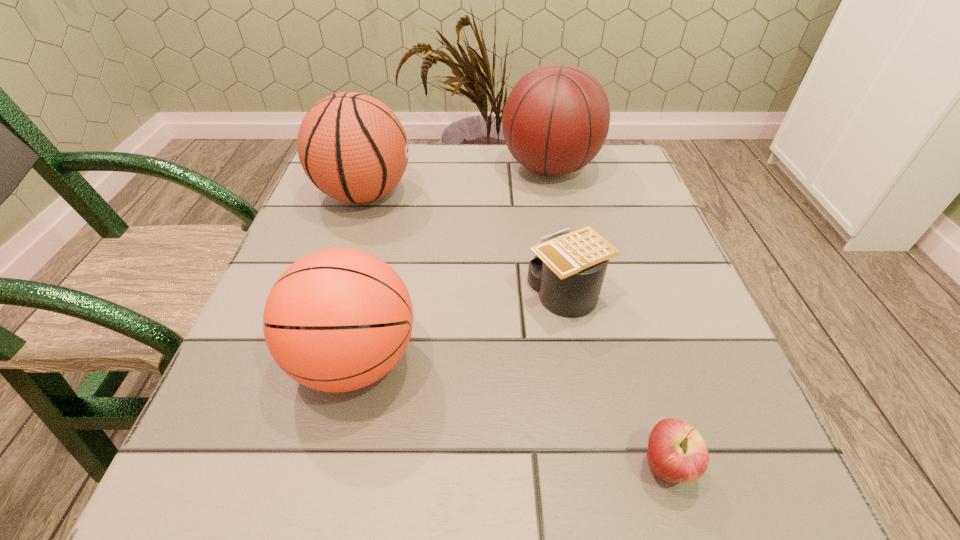
At what (x,y) coordinates should I click in order to perform the action: click on the rightmost basketball. Please return your answer as a coordinate pair (x, y). Looking at the image, I should click on (556, 119).

You are a GUI agent. You are given a task and a screenshot of the screen. Output one action in this format:
    pyautogui.click(x=<x>, y=<y>)
    Task: Click on the nearest basketball
    This screenshot has width=960, height=540.
    Given the screenshot: What is the action you would take?
    pyautogui.click(x=337, y=320)

This screenshot has width=960, height=540. I want to click on calculator, so click(568, 270).

Where is `apple`? apple is located at coordinates (677, 452).

This screenshot has width=960, height=540. I want to click on free space located 0.070m on the front of the rightmost basketball, so click(560, 215).

Where is `vacant area situated 0.300m on the back of the nearest basketball`? This screenshot has width=960, height=540. vacant area situated 0.300m on the back of the nearest basketball is located at coordinates (392, 206).

Locate an element on the screen. Image resolution: width=960 pixels, height=540 pixels. vacant space located 0.170m on the front of the calculator is located at coordinates (590, 423).

The width and height of the screenshot is (960, 540). What are the coordinates of `vacant space positioned 0.390m on the back of the nearest object` in the screenshot? It's located at (601, 247).

You are a GUI agent. You are given a task and a screenshot of the screen. Output one action in this format:
    pyautogui.click(x=<x>, y=<y>)
    Task: Click on the object that is at the near edge
    
    Given the screenshot: What is the action you would take?
    pyautogui.click(x=677, y=452)

At what (x,y) coordinates should I click in order to perform the action: click on basketball located in the right edge section of the desktop. Please return your answer as a coordinate pair (x, y). The height and width of the screenshot is (540, 960). Looking at the image, I should click on (556, 119).